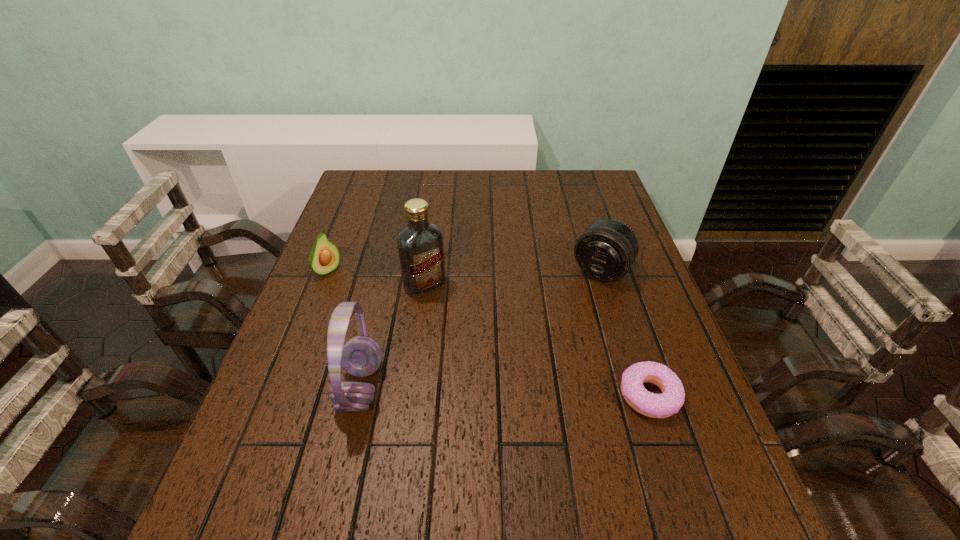
You are a GUI agent. You are given a task and a screenshot of the screen. Output one action in this format:
    pyautogui.click(x=<x>, y=<y>)
    Task: Click on the free space located 0.360m on the front-facing side of the third object from left to right
    This screenshot has width=960, height=540.
    Given the screenshot: What is the action you would take?
    pyautogui.click(x=511, y=399)

Where is `headset positioned at the left edge`? Image resolution: width=960 pixels, height=540 pixels. headset positioned at the left edge is located at coordinates (361, 356).

The height and width of the screenshot is (540, 960). I want to click on avocado located at the left edge, so [324, 258].

Find the location of a particular element. The width and height of the screenshot is (960, 540). doughnut located at the right edge is located at coordinates 653,405.

You are a GUI agent. You are given a task and a screenshot of the screen. Output one action in this format:
    pyautogui.click(x=<x>, y=<y>)
    Task: Click on the telephoto lens located in the right edge section of the desktop
    The width and height of the screenshot is (960, 540).
    Given the screenshot: What is the action you would take?
    click(606, 250)

This screenshot has height=540, width=960. In the image, there is a desktop. In order to click on vacant space at the far edge in this screenshot , I will do `click(476, 204)`.

In the image, there is a desktop. Identify the location of vacant space at the left edge. (300, 427).

In the image, there is a desktop. Where is `vacant region at the right edge`? The height and width of the screenshot is (540, 960). vacant region at the right edge is located at coordinates (652, 316).

This screenshot has height=540, width=960. Find the location of `free location at the far left corner of the desktop`. free location at the far left corner of the desktop is located at coordinates 386,180.

Image resolution: width=960 pixels, height=540 pixels. I want to click on vacant area at the near left corner of the desktop, so click(x=303, y=467).